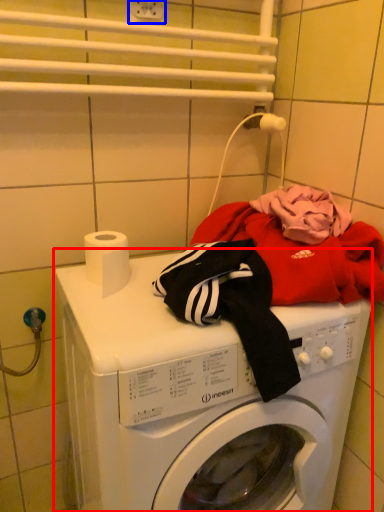
Question: Which object is further to the camera taking this photo, washing machine (highlighted by a red box) or electric outlet (highlighted by a blue box)?

Choices:
 (A) washing machine
 (B) electric outlet

Answer: (B)